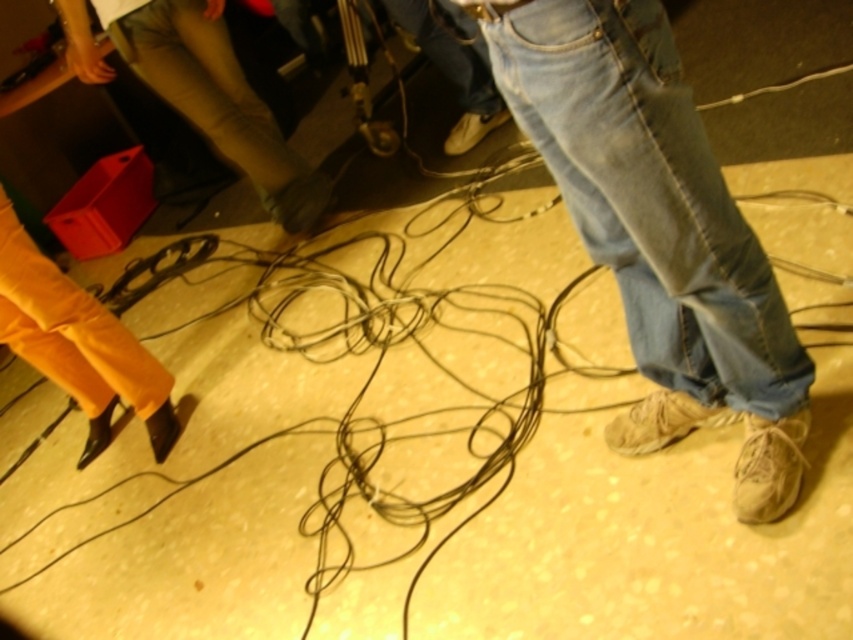
Question: Is denim jeans at center below khaki cotton pants at center?

Choices:
 (A) yes
 (B) no

Answer: (A)

Question: Does denim jeans at center have a larger size compared to khaki cotton pants at center?

Choices:
 (A) no
 (B) yes

Answer: (A)

Question: Which of the following is the farthest from the observer?

Choices:
 (A) denim jeans at center
 (B) khaki cotton pants at center

Answer: (B)

Question: Among these objects, which one is farthest from the camera?

Choices:
 (A) khaki cotton pants at center
 (B) denim jeans at center

Answer: (A)

Question: Can you confirm if denim jeans at center is wider than khaki cotton pants at center?

Choices:
 (A) yes
 (B) no

Answer: (B)

Question: Which object appears farthest from the camera in this image?

Choices:
 (A) denim jeans at center
 (B) khaki cotton pants at center

Answer: (B)